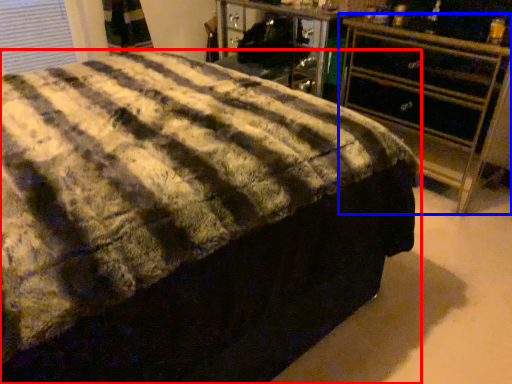
Question: Which point is closer to the camera, bed (highlighted by a red box) or chest of drawers (highlighted by a blue box)?

Choices:
 (A) bed
 (B) chest of drawers

Answer: (A)